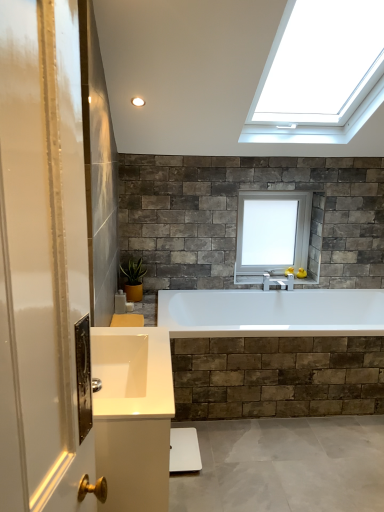
Question: From the image's perspective, is green matte plant at lower left on white glossy sink at lower left?

Choices:
 (A) no
 (B) yes

Answer: (B)

Question: Is green matte plant at lower left to the left of white glossy sink at lower left from the viewer's perspective?

Choices:
 (A) no
 (B) yes

Answer: (B)

Question: From the image's perspective, would you say green matte plant at lower left is shown under white glossy sink at lower left?

Choices:
 (A) no
 (B) yes

Answer: (A)

Question: Is green matte plant at lower left bigger than white glossy sink at lower left?

Choices:
 (A) yes
 (B) no

Answer: (B)

Question: From a real-world perspective, is green matte plant at lower left below white glossy sink at lower left?

Choices:
 (A) no
 (B) yes

Answer: (B)

Question: Considering the positions of point (120, 270) and point (249, 253), is point (120, 270) closer or farther from the camera than point (249, 253)?

Choices:
 (A) closer
 (B) farther

Answer: (A)

Question: From a real-world perspective, is green matte plant at lower left positioned above or below white glass window at upper center?

Choices:
 (A) below
 (B) above

Answer: (A)

Question: Considering the positions of green matte plant at lower left and white glass window at upper center in the image, is green matte plant at lower left wider or thinner than white glass window at upper center?

Choices:
 (A) thin
 (B) wide

Answer: (B)

Question: Considering the relative positions of green matte plant at lower left and white glass window at upper center in the image provided, is green matte plant at lower left to the left or to the right of white glass window at upper center?

Choices:
 (A) left
 (B) right

Answer: (A)

Question: In the image, is white glossy sink at lower left on the left side or the right side of green matte plant at lower left?

Choices:
 (A) right
 (B) left

Answer: (A)

Question: Does point (135, 401) appear closer or farther from the camera than point (134, 274)?

Choices:
 (A) closer
 (B) farther

Answer: (A)

Question: Is white glossy sink at lower left inside the boundaries of green matte plant at lower left, or outside?

Choices:
 (A) inside
 (B) outside

Answer: (B)

Question: In terms of size, does white glossy sink at lower left appear bigger or smaller than green matte plant at lower left?

Choices:
 (A) small
 (B) big

Answer: (B)

Question: Looking at their shapes, would you say white glossy sink at lower left is wider or thinner than white glass window at upper center?

Choices:
 (A) wide
 (B) thin

Answer: (A)

Question: Does point (122, 330) appear closer or farther from the camera than point (246, 247)?

Choices:
 (A) closer
 (B) farther

Answer: (A)